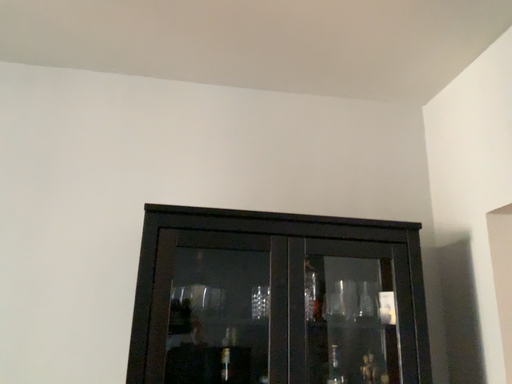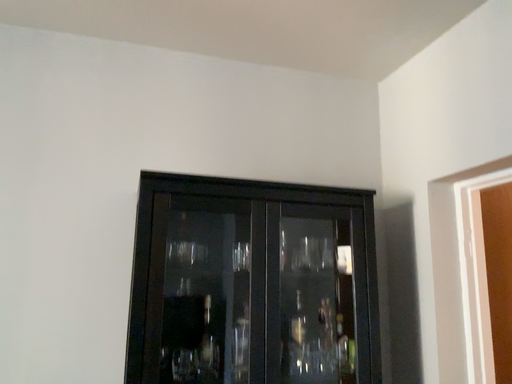
Question: Which way did the camera rotate in the video?

Choices:
 (A) rotated right
 (B) rotated left

Answer: (A)